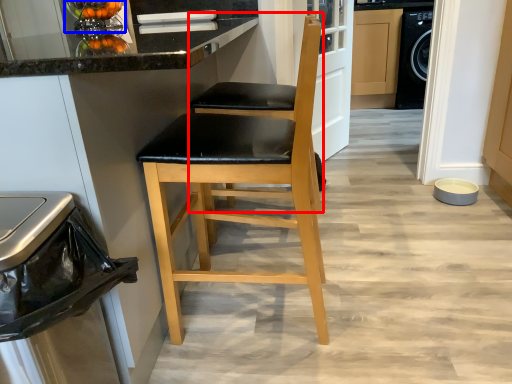
Question: Among these objects, which one is nearest to the camera, chair (highlighted by a red box) or appliance (highlighted by a blue box)?

Choices:
 (A) chair
 (B) appliance

Answer: (A)